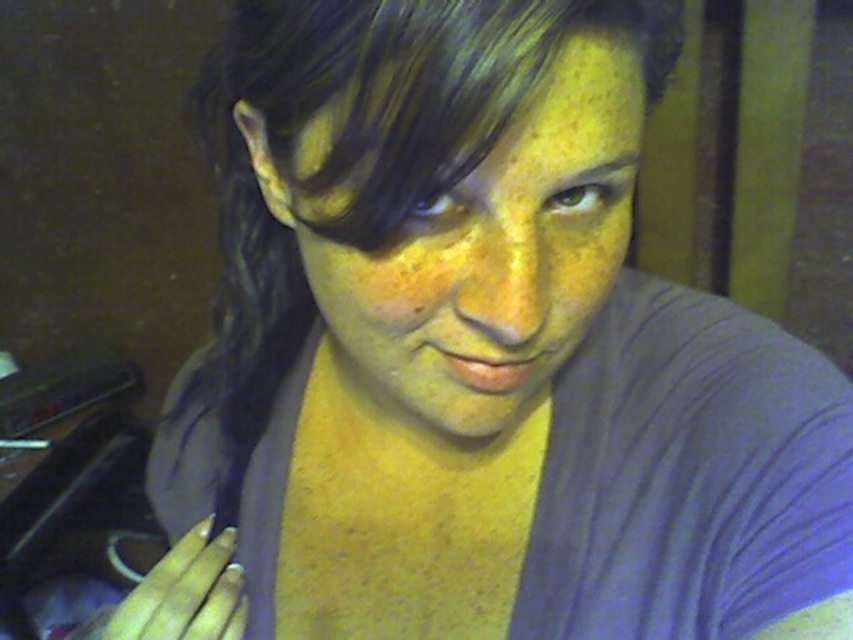
Question: Which of the following is the closest to the observer?

Choices:
 (A) matte gray face at center
 (B) white painted nails at lower left

Answer: (A)

Question: Is matte gray face at center positioned at the back of white painted nails at lower left?

Choices:
 (A) yes
 (B) no

Answer: (B)

Question: Which point is farther to the camera?

Choices:
 (A) pyautogui.click(x=485, y=195)
 (B) pyautogui.click(x=178, y=588)

Answer: (B)

Question: Does matte gray face at center have a greater width compared to white painted nails at lower left?

Choices:
 (A) no
 (B) yes

Answer: (B)

Question: Can you confirm if matte gray face at center is positioned above white painted nails at lower left?

Choices:
 (A) no
 (B) yes

Answer: (B)

Question: Which point appears closest to the camera in this image?

Choices:
 (A) (144, 605)
 (B) (578, 88)

Answer: (B)